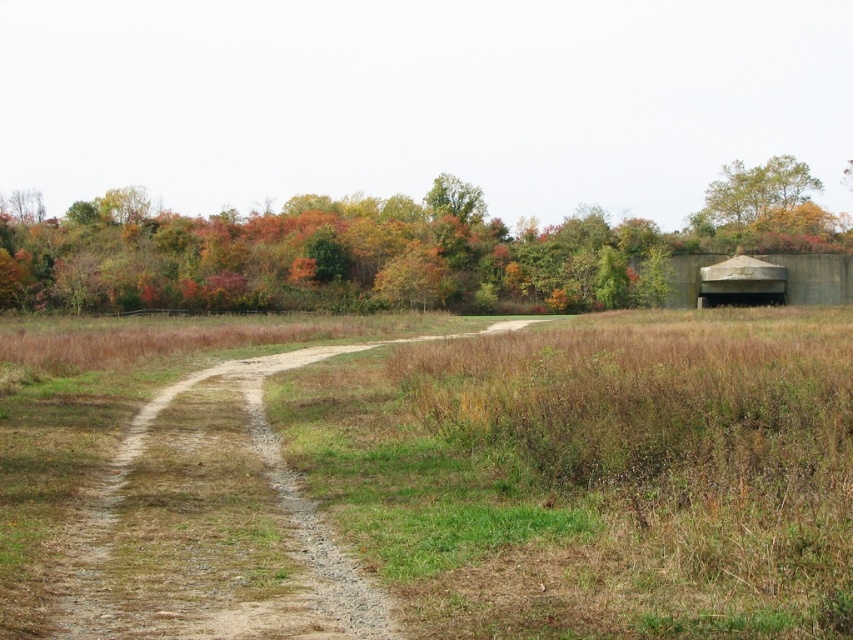
In the scene shown: Who is positioned more to the left, dirt/gravel trail at center or yellow-green foliage at upper right?

dirt/gravel trail at center is more to the left.

This screenshot has height=640, width=853. What do you see at coordinates (216, 522) in the screenshot? I see `dirt/gravel trail at center` at bounding box center [216, 522].

This screenshot has height=640, width=853. What do you see at coordinates (216, 522) in the screenshot? I see `dirt/gravel trail at center` at bounding box center [216, 522].

At what (x,y) coordinates should I click in order to perform the action: click on dirt/gravel trail at center. Please return your answer as a coordinate pair (x, y). The height and width of the screenshot is (640, 853). Looking at the image, I should click on (216, 522).

Consider the image. Who is more distant from viewer, (x=244, y=620) or (x=485, y=211)?

Positioned behind is point (x=485, y=211).

Between dirt/gravel trail at center and green leafy tree at upper center, which one appears on the right side from the viewer's perspective?

From the viewer's perspective, green leafy tree at upper center appears more on the right side.

The height and width of the screenshot is (640, 853). What do you see at coordinates (216, 522) in the screenshot?
I see `dirt/gravel trail at center` at bounding box center [216, 522].

The height and width of the screenshot is (640, 853). In order to click on dirt/gravel trail at center in this screenshot , I will do (216, 522).

Can you confirm if yellow-green foliage at upper right is wider than green leafy tree at upper center?

Correct, the width of yellow-green foliage at upper right exceeds that of green leafy tree at upper center.

Between yellow-green foliage at upper right and green leafy tree at upper center, which one has less height?

With less height is green leafy tree at upper center.

Is point (796, 204) in front of point (463, 195)?

No, it is not.

Where is `yellow-green foliage at upper right`? yellow-green foliage at upper right is located at coordinates (756, 192).